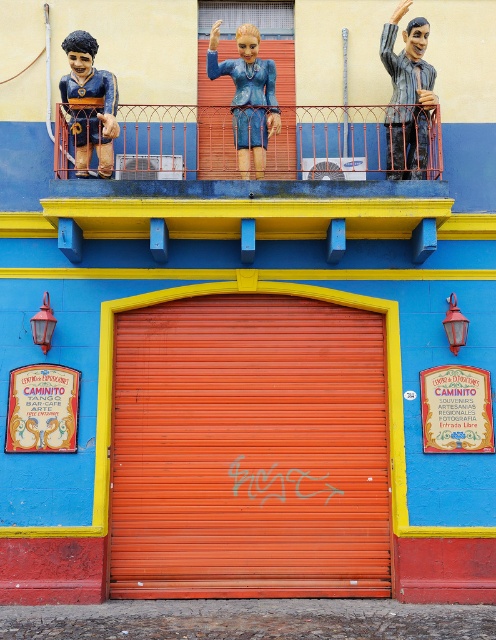
Question: Which of these objects is positioned farthest from the metallic red railing at upper center?

Choices:
 (A) orange matte garage door at center
 (B) matte blue figure at center
 (C) matte gray statue at upper right

Answer: (A)

Question: Estimate the real-world distances between objects in this image. Which object is farther from the matte blue figure at center?

Choices:
 (A) metallic red railing at upper center
 (B) orange matte garage door at center

Answer: (B)

Question: Where is orange matte garage door at center located in relation to matte blue figure at center in the image?

Choices:
 (A) above
 (B) below

Answer: (B)

Question: Is orange matte garage door at center to the right of matte blue figure at center from the viewer's perspective?

Choices:
 (A) no
 (B) yes

Answer: (A)

Question: Does matte gray statue at upper right have a lesser width compared to matte blue plastic boy at upper left?

Choices:
 (A) yes
 (B) no

Answer: (A)

Question: Among these points, which one is farthest from the camera?

Choices:
 (A) (94, 90)
 (B) (229, 307)
 (C) (78, 220)
 (D) (249, 48)

Answer: (B)